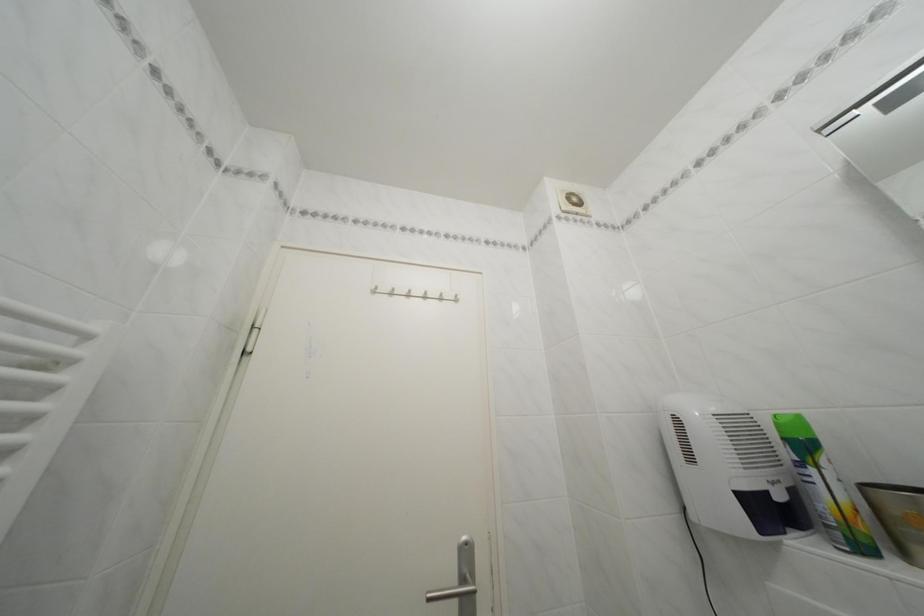
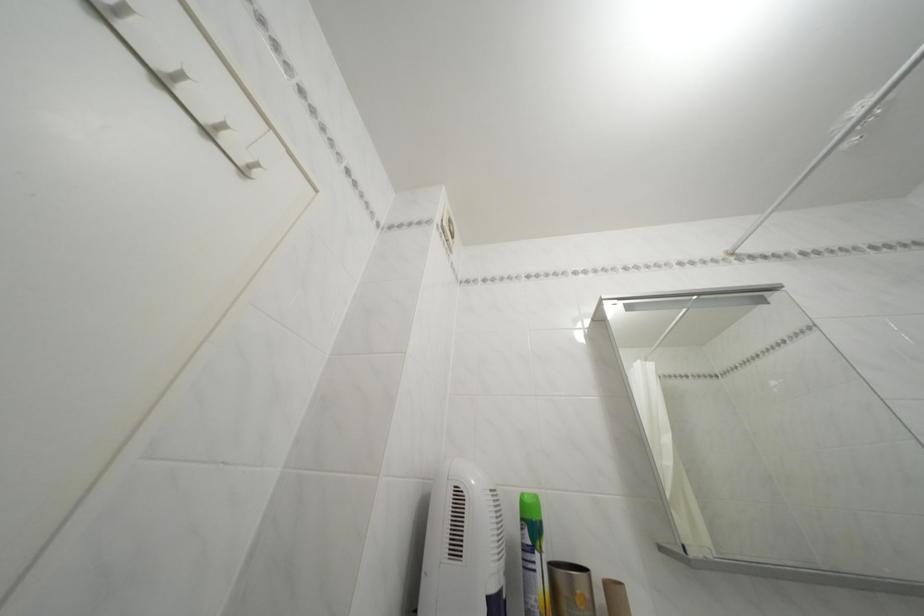
Based on the continuous images, in which direction is the camera rotating?

The rotation direction of the camera is right-up.